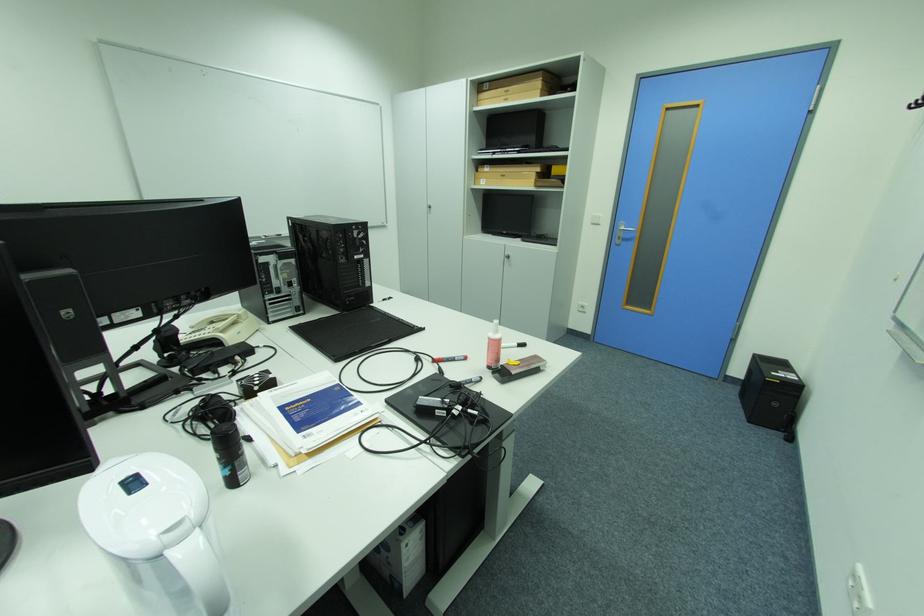
What do you see at coordinates (593, 219) in the screenshot? Image resolution: width=924 pixels, height=616 pixels. I see `a white light switch` at bounding box center [593, 219].